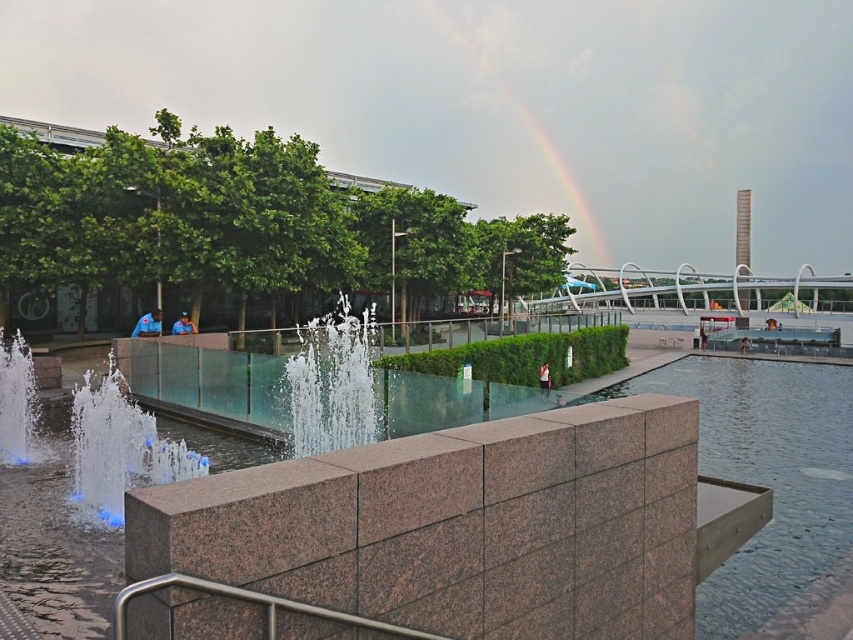
Question: Does clear water fountain at center have a smaller size compared to rainbow at upper center?

Choices:
 (A) yes
 (B) no

Answer: (A)

Question: Which object appears closest to the camera in this image?

Choices:
 (A) blue-lit water at lower left
 (B) green leafy trees at left
 (C) silver metallic handrail at lower center

Answer: (C)

Question: Which object is the closest to the blue-lit water at lower left?

Choices:
 (A) rainbow at upper center
 (B) silver metallic handrail at lower center

Answer: (B)

Question: Is blue-lit water at lower left closer to the viewer compared to green leafy trees at left?

Choices:
 (A) no
 (B) yes

Answer: (B)

Question: Where is blue-lit water at lower left located in relation to clear water fountain at center in the image?

Choices:
 (A) below
 (B) above

Answer: (A)

Question: Which point appears closest to the camera in this image?

Choices:
 (A) (541, 136)
 (B) (219, 586)
 (C) (341, 330)
 (D) (714, 429)

Answer: (B)